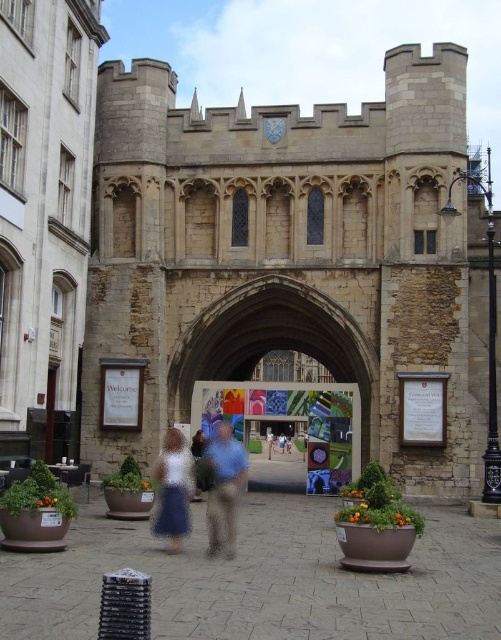
Image resolution: width=501 pixels, height=640 pixels. Identify the location of blue denim jeans at center. (197, 445).

Is point (196, 484) farther from viewer compared to point (272, 442)?

That is False.

Locate an element on the screen. This screenshot has width=501, height=640. blue denim jeans at center is located at coordinates (197, 445).

Image resolution: width=501 pixels, height=640 pixels. In order to click on blue denim jeans at center in this screenshot , I will do `click(197, 445)`.

Does light blue denim jeans at center appear under blue denim shorts at center?

Incorrect, light blue denim jeans at center is not positioned below blue denim shorts at center.

Who is more forward, (269, 435) or (282, 444)?

→ Point (269, 435) is in front.

The width and height of the screenshot is (501, 640). Find the location of `light blue denim jeans at center`. light blue denim jeans at center is located at coordinates tap(270, 440).

Does stone archway at center have a greater width compared to blue denim shorts at center?

Yes.

This screenshot has width=501, height=640. Find the location of `stone archway at center`. stone archway at center is located at coordinates (277, 340).

Find the location of `stone archway at center`. stone archway at center is located at coordinates (277, 340).